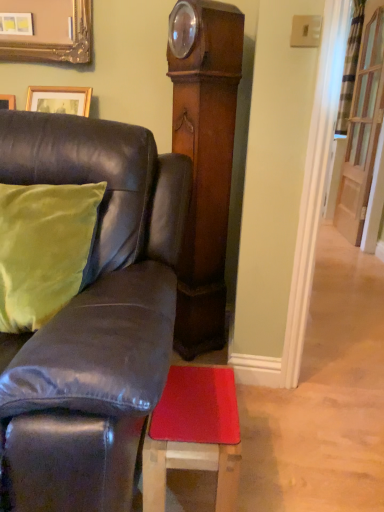
Question: Is leather couch at left facing away from clear glass door at upper right?

Choices:
 (A) no
 (B) yes

Answer: (A)

Question: Is leather couch at left next to clear glass door at upper right?

Choices:
 (A) yes
 (B) no

Answer: (B)

Question: Considering the relative sizes of leather couch at left and clear glass door at upper right in the image provided, is leather couch at left shorter than clear glass door at upper right?

Choices:
 (A) no
 (B) yes

Answer: (B)

Question: From a real-world perspective, is leather couch at left on top of clear glass door at upper right?

Choices:
 (A) no
 (B) yes

Answer: (A)

Question: From a real-world perspective, is leather couch at left physically below clear glass door at upper right?

Choices:
 (A) no
 (B) yes

Answer: (B)

Question: Is point (228, 385) positioned closer to the camera than point (39, 385)?

Choices:
 (A) farther
 (B) closer

Answer: (A)

Question: Is rubberized red mat at lower center inside the boundaries of leather couch at left, or outside?

Choices:
 (A) outside
 (B) inside

Answer: (B)

Question: From a real-world perspective, is rubberized red mat at lower center positioned above or below leather couch at left?

Choices:
 (A) below
 (B) above

Answer: (A)

Question: Is rubberized red mat at lower center taller or shorter than leather couch at left?

Choices:
 (A) short
 (B) tall

Answer: (A)

Question: Is clear glass door at upper right spatially inside rubberized red mat at lower center, or outside of it?

Choices:
 (A) outside
 (B) inside

Answer: (A)

Question: Is clear glass door at upper right taller or shorter than rubberized red mat at lower center?

Choices:
 (A) short
 (B) tall

Answer: (B)

Question: Considering the relative positions of clear glass door at upper right and rubberized red mat at lower center in the image provided, is clear glass door at upper right to the left or to the right of rubberized red mat at lower center?

Choices:
 (A) right
 (B) left

Answer: (A)

Question: Is clear glass door at upper right in front of or behind rubberized red mat at lower center in the image?

Choices:
 (A) front
 (B) behind

Answer: (B)

Question: Is green velvet pillow at left taller or shorter than clear glass door at upper right?

Choices:
 (A) tall
 (B) short

Answer: (B)

Question: From the image's perspective, relative to clear glass door at upper right, is green velvet pillow at left above or below?

Choices:
 (A) below
 (B) above

Answer: (A)